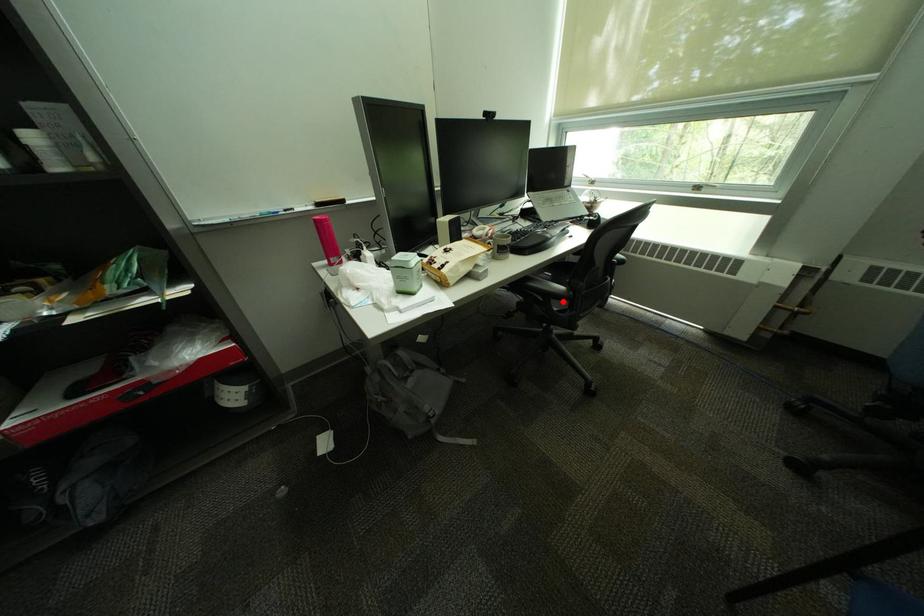
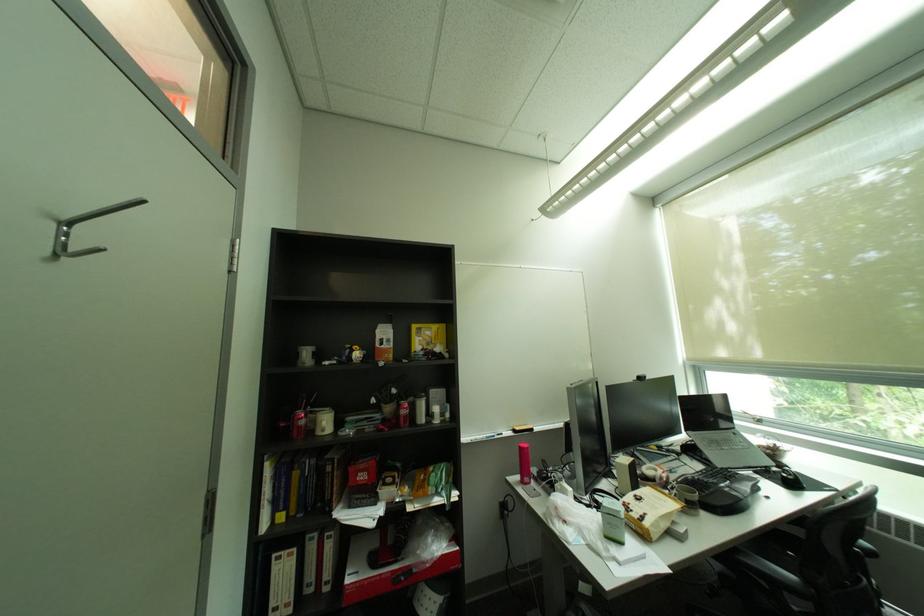
Question: A red point is marked in image1. In image2, is the corresponding 3D point closer to the camera or farther? Reply with the corresponding letter.

Choices:
 (A) The corresponding 3D point is closer.
 (B) The corresponding 3D point is farther.

Answer: (A)